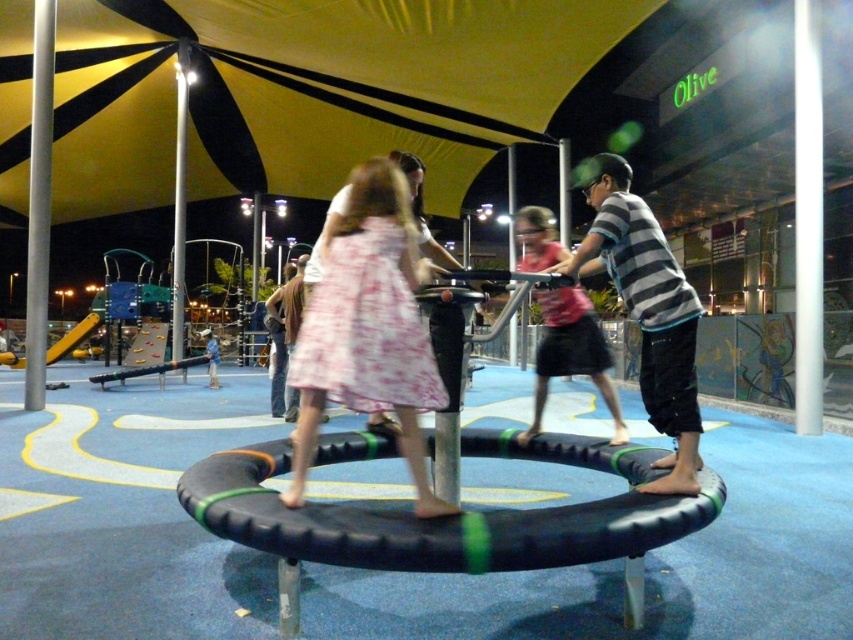
You are a parent trying to ensure safety in the playground. You notice the black rubber tire at center and the striped cotton shirt at center. Which object is wider?

The black rubber tire at center is wider than the striped cotton shirt at center.

Based on the photo, you are standing in the indoor playground and want to place a small toy between the two points, point [399,556] and point [693,333]. Which point should you place the toy closer to so that it is nearer to the trampoline platform?

The toy should be placed closer to point [399,556] because it is closer to the viewer, and the trampoline platform is in the foreground of the image.

You are standing at the entrance of the indoor playground and want to place a new toy exactly at the center of the black rubber tire at center. According to the coordinates provided, where should you place the toy?

The toy should be placed at the coordinates point (448,516), which is the 2D location of the black rubber tire at center.